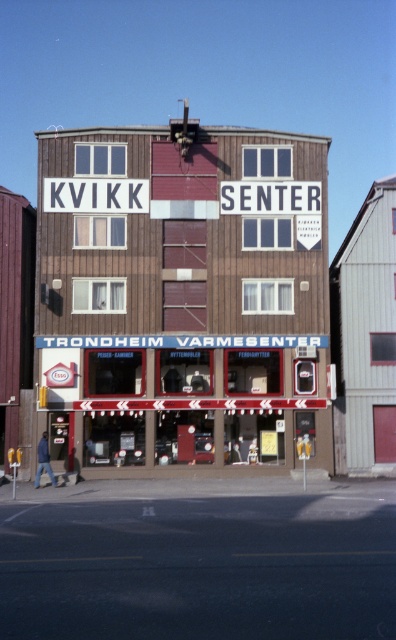
Is brown wood paneling at center wider than matte brown storefront at center?

Yes.

Between brown wood paneling at center and matte brown storefront at center, which one appears on the left side from the viewer's perspective?

brown wood paneling at center is more to the left.

Is point (319, 136) farther from camera compared to point (59, 368)?

That is True.

You are a GUI agent. You are given a task and a screenshot of the screen. Output one action in this format:
    pyautogui.click(x=<x>, y=<y>)
    Task: Click on the brown wood paneling at center
    This screenshot has width=396, height=640.
    Given the screenshot: What is the action you would take?
    pyautogui.click(x=182, y=294)

Image resolution: width=396 pixels, height=640 pixels. What are the coordinates of `white corrugated metal building at right` in the screenshot? It's located at (365, 337).

Is point (357, 308) in front of point (226, 374)?

No.

The height and width of the screenshot is (640, 396). I want to click on white corrugated metal building at right, so click(x=365, y=337).

Does brown wood paneling at center have a lesser width compared to white corrugated metal building at right?

Indeed, brown wood paneling at center has a lesser width compared to white corrugated metal building at right.

Is brown wood paneling at center above white corrugated metal building at right?

No.

Is point (260, 317) positioned before point (331, 337)?

Yes, it is.

I want to click on brown wood paneling at center, so click(x=182, y=294).